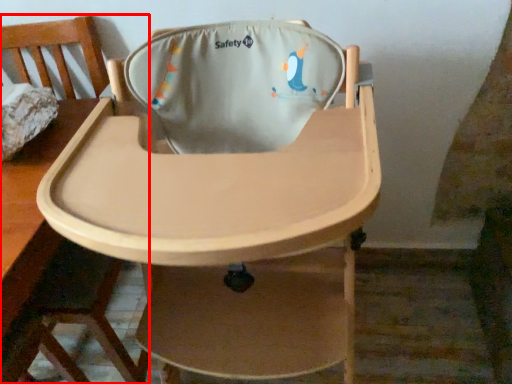
Question: From the image's perspective, what is the correct spatial positioning of chair (annotated by the red box) in reference to chair?

Choices:
 (A) above
 (B) below

Answer: (A)